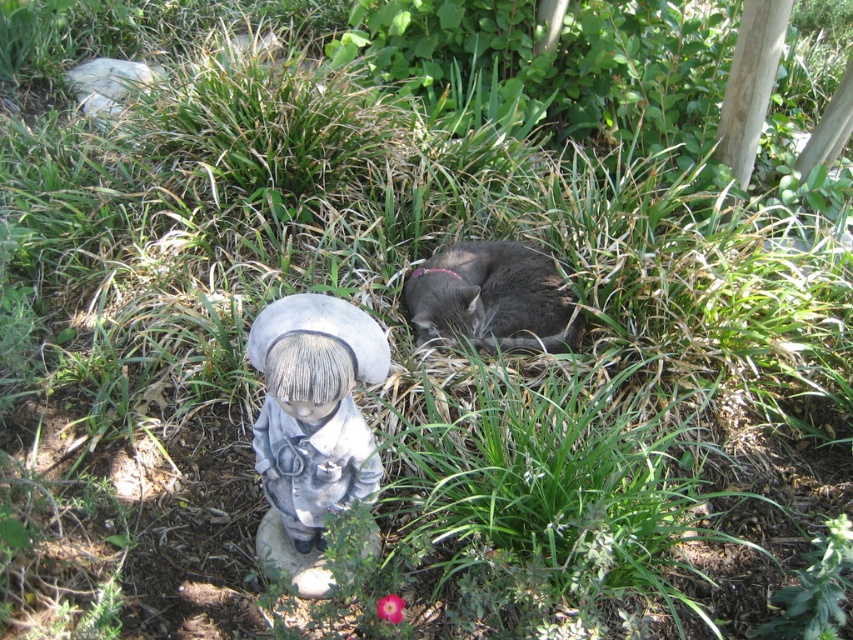
Consider the image. Between gray stone figurine at lower left and gray fur cat at center, which one has less height?

gray fur cat at center is shorter.

Between gray stone figurine at lower left and gray fur cat at center, which one is positioned lower?

gray stone figurine at lower left

Find the location of `gray stone figurine at lower left`. gray stone figurine at lower left is located at coordinates (314, 408).